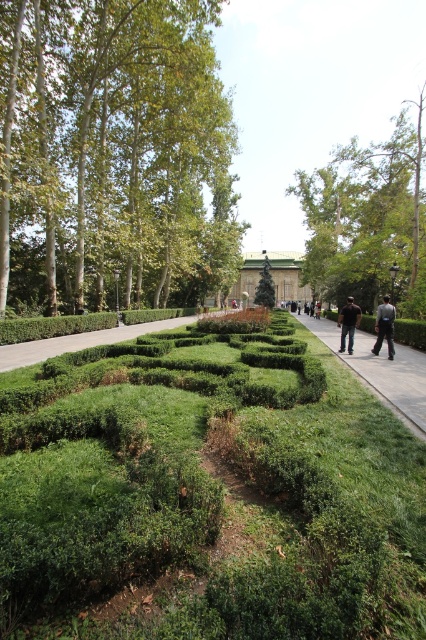
Question: Does dark gray uniform at center appear under black cotton shirt at right?

Choices:
 (A) no
 (B) yes

Answer: (A)

Question: Estimate the real-world distances between objects in this image. Which object is farther from the gray concrete sidewalk at center?

Choices:
 (A) dark gray uniform at center
 (B) smooth white tree at upper left
 (C) green leafy tree at upper center

Answer: (C)

Question: Can you confirm if smooth white tree at upper left is smaller than green polished stone statue at center?

Choices:
 (A) no
 (B) yes

Answer: (A)

Question: Which of the following is the closest to the observer?

Choices:
 (A) black cotton shirt at right
 (B) green polished stone statue at center
 (C) dark gray uniform at center
 (D) smooth white tree at upper left

Answer: (C)

Question: Is green leafy hedge at center behind gray concrete sidewalk at center?

Choices:
 (A) no
 (B) yes

Answer: (A)

Question: Which object is the farthest from the dark gray uniform at center?

Choices:
 (A) smooth white tree at upper left
 (B) green leafy hedge at center
 (C) green polished stone statue at center

Answer: (C)